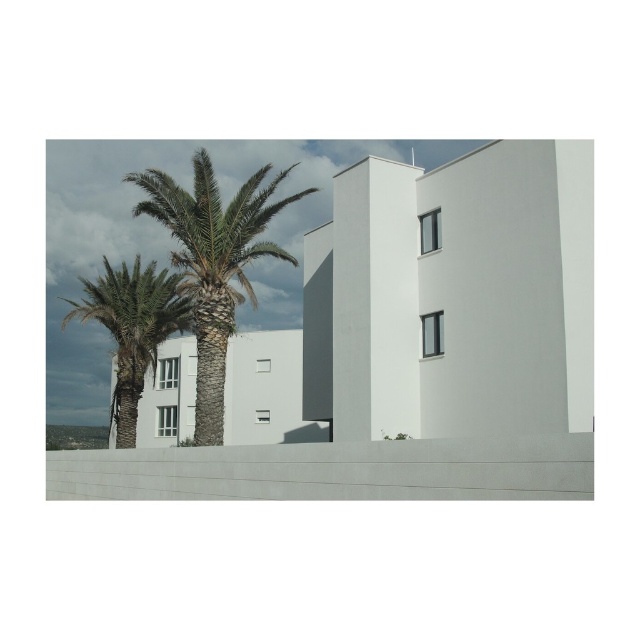
You are standing in front of the modern architectural structure and want to take a photo of the green leafy palm tree at center. According to the coordinates provided, where exactly should you position the camera to capture the palm tree in the frame?

The green leafy palm tree at center is located at coordinates point (212, 262), so you should position the camera to focus on that specific point to capture the palm tree in the frame.

You are standing in front of the modern building and want to take a photo that includes both the green leafy palm tree at center and the green leafy palm tree at left. Which palm tree should you focus on to ensure the taller one is clearly visible in your photo?

The green leafy palm tree at center is much taller than the green leafy palm tree at left, so focusing on it will ensure the taller one is clearly visible.